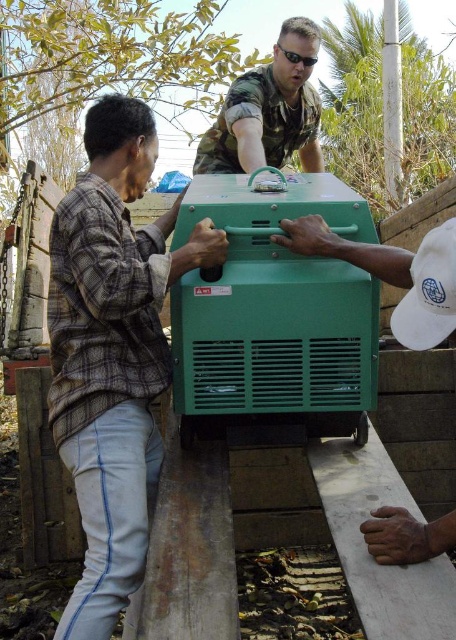
Question: Can you confirm if green plastic generator at center is positioned to the left of camouflage fabric uniform at upper center?

Choices:
 (A) no
 (B) yes

Answer: (A)

Question: From the image, what is the correct spatial relationship of green plastic generator at center in relation to camouflage fabric uniform at upper center?

Choices:
 (A) left
 (B) right

Answer: (B)

Question: Does green plastic generator at center appear over camouflage fabric uniform at upper center?

Choices:
 (A) no
 (B) yes

Answer: (A)

Question: Among these objects, which one is nearest to the camera?

Choices:
 (A) camouflage fabric uniform at upper center
 (B) green plastic generator at center

Answer: (B)

Question: Which object is positioned farthest from the green plastic generator at center?

Choices:
 (A) camouflage fabric uniform at upper center
 (B) plaid fabric shirt at left

Answer: (A)

Question: Which point is farther to the camera?

Choices:
 (A) camouflage fabric uniform at upper center
 (B) plaid fabric shirt at left
 (C) green plastic generator at center

Answer: (A)